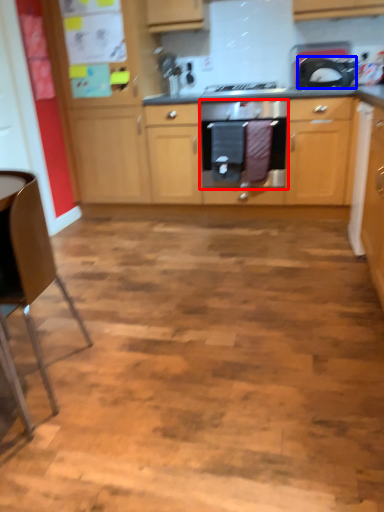
Question: Among these objects, which one is nearest to the camera, home appliance (highlighted by a red box) or kitchen appliance (highlighted by a blue box)?

Choices:
 (A) home appliance
 (B) kitchen appliance

Answer: (B)